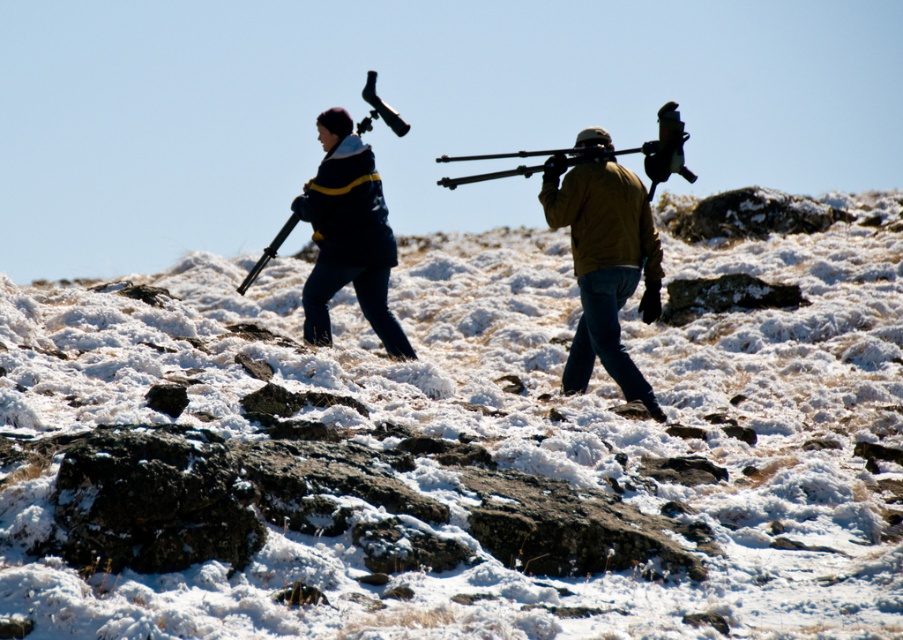
You are planning to take a photo of the two people in the snowy terrain. You want to ensure both the brown leather jacket at center and the matte black jacket at center are clearly visible in the frame. Given their sizes, which jacket should you focus on to ensure both are in focus?

The brown leather jacket at center is narrower than the matte black jacket at center, so focusing on the matte black jacket at center would ensure both are in focus since it is wider and might require a larger depth of field.

You are planning to carry both the brown leather jacket at center and the matte black rifle at center in a backpack. Which item will require a larger compartment in terms of width?

The matte black rifle at center requires a larger compartment because its width is greater than the brown leather jacket at center.

You are a photographer planning to take a photo of the two people in the snowy terrain. You want to ensure both the brown leather jacket at center and the matte black jacket at center are clearly visible in the frame. Based on their positions, which jacket should you focus on first to ensure both are in focus?

The brown leather jacket at center is in front of the matte black jacket at center, so you should focus on the brown leather jacket at center first to ensure both are in focus.